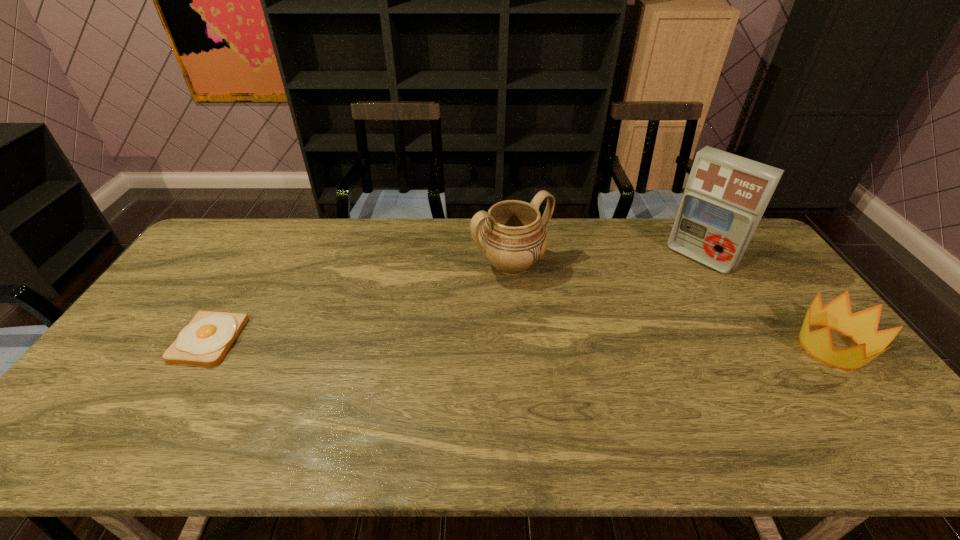
At what (x,y) coordinates should I click in order to perform the action: click on the shortest object. Please return your answer as a coordinate pair (x, y). Looking at the image, I should click on (x=205, y=341).

The image size is (960, 540). In order to click on the leftmost object in this screenshot , I will do `click(205, 341)`.

Where is `the third tallest object`? The image size is (960, 540). the third tallest object is located at coordinates (862, 326).

The height and width of the screenshot is (540, 960). Identify the location of crown. (862, 326).

You are a GUI agent. You are given a task and a screenshot of the screen. Output one action in this format:
    pyautogui.click(x=<x>, y=<y>)
    Task: Click on the tallest object
    
    Given the screenshot: What is the action you would take?
    pyautogui.click(x=726, y=195)

I want to click on the first-aid kit, so click(726, 195).

This screenshot has height=540, width=960. I want to click on the second tallest object, so click(513, 237).

Find the location of a particular element. The image size is (960, 540). the second object from left to right is located at coordinates (513, 237).

Image resolution: width=960 pixels, height=540 pixels. Find the location of `free spot located 0.060m on the back of the toast`. free spot located 0.060m on the back of the toast is located at coordinates (232, 301).

At what (x,y) coordinates should I click in order to perform the action: click on free spot located 0.300m on the left of the rightmost object. Please return your answer as a coordinate pair (x, y). Image resolution: width=960 pixels, height=540 pixels. Looking at the image, I should click on (687, 347).